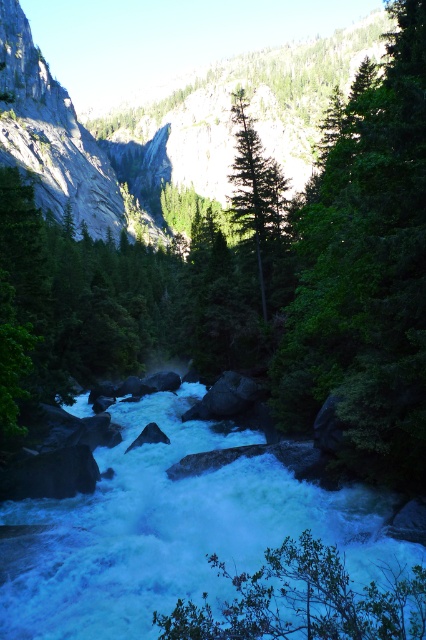
You are planning to set up a campsite between the green leafy tree at center and the green matte tree at center. Which tree should you choose to place your tent closer to if you want to maximize the shaded area available under the tree?

The green leafy tree at center is wider than the green matte tree at center, so placing the tent closer to the green leafy tree at center would provide a larger shaded area.

You are a hiker standing at the edge of the river. You see the rough granite mountain at center and the green leafy tree at lower center. Which object is closer to you?

The green leafy tree at lower center is behind the rough granite mountain at center, so the rough granite mountain at center is closer to you.